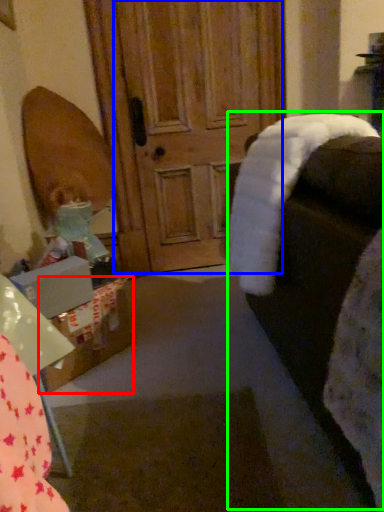
Question: Estimate the real-world distances between objects in this image. Which object is farther from cardboard box (highlighted by a red box), screen door (highlighted by a blue box) or rocking chair (highlighted by a green box)?

Choices:
 (A) screen door
 (B) rocking chair

Answer: (A)